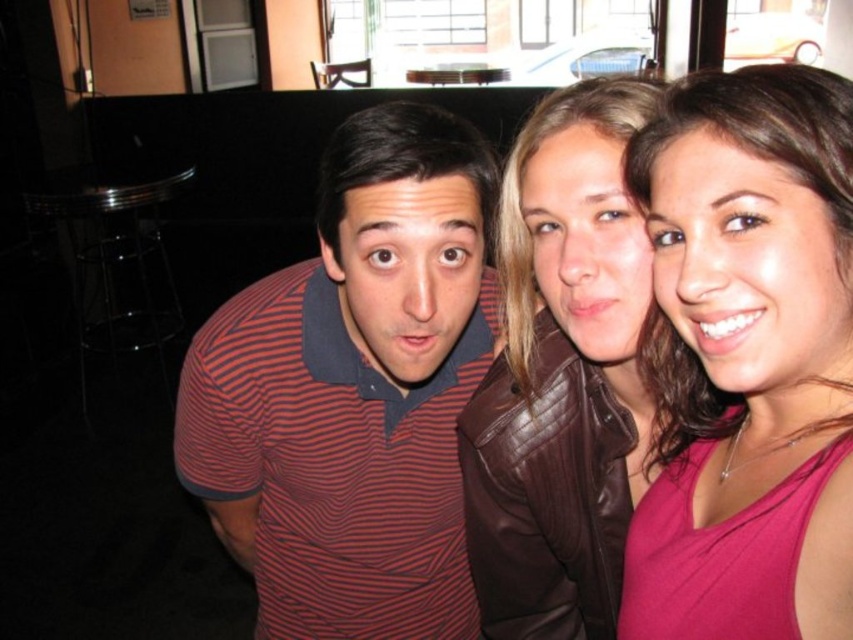
You are organizing a clothing donation drive and need to categorize items by size. You have two garments in front of you, the pink matte tank top at center and the striped polo shirt at center. Which one should you place in the small size bin?

The pink matte tank top at center has a smaller size compared to the striped polo shirt at center, so it should be placed in the small size bin.

You are standing in front of the group photo. There are two points marked on the image, one at coordinates point (792, 193) and the other at point (755, 72). Which of these points is nearer to you?

Point (792, 193) is closer to the camera than point (755, 72), so the point at coordinates point (792, 193) is nearer to you.